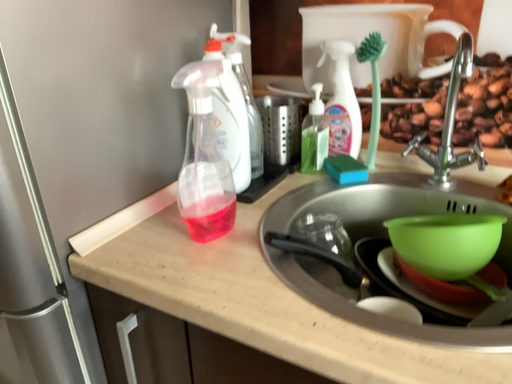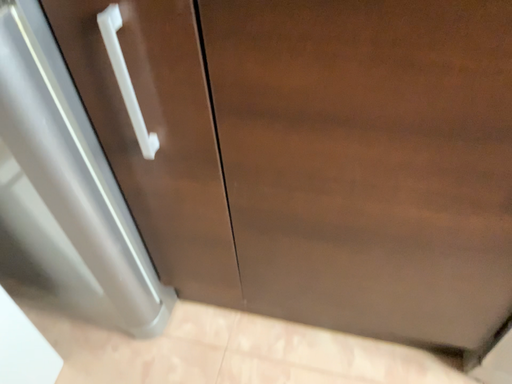
Question: Which way did the camera rotate in the video?

Choices:
 (A) rotated left
 (B) rotated right

Answer: (B)